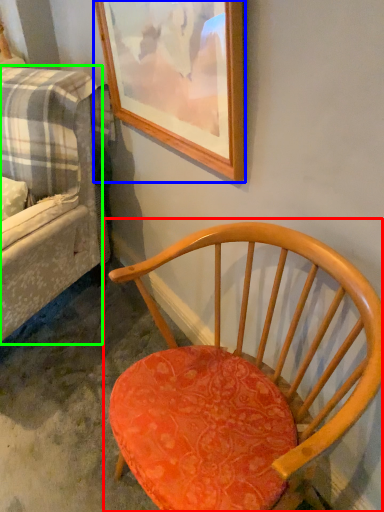
Question: Based on their relative distances, which object is nearer to chair (highlighted by a red box)? Choose from picture frame (highlighted by a blue box) and studio couch (highlighted by a green box).

Choices:
 (A) picture frame
 (B) studio couch

Answer: (A)